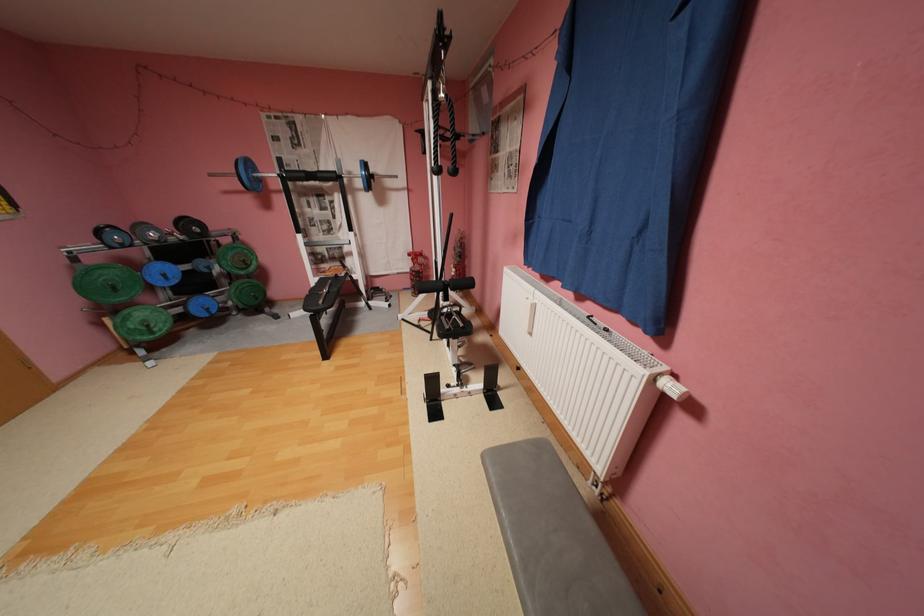
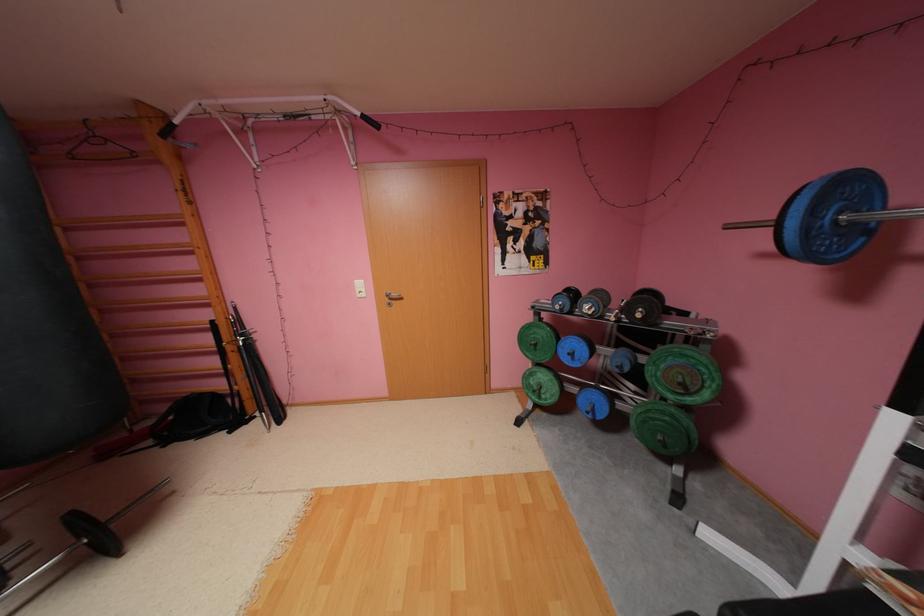
In the second image, find the point that corresponds to the point at 175,276 in the first image.

(580, 354)